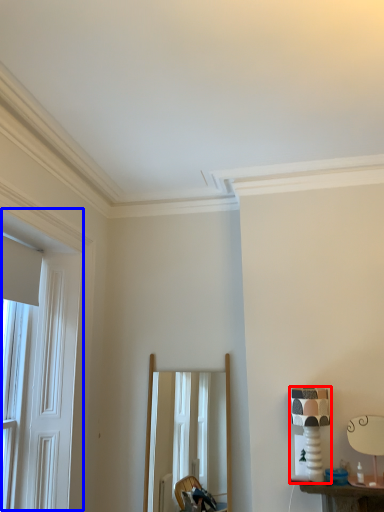
Question: Which object is closer to the camera taking this photo, table lamp (highlighted by a red box) or window (highlighted by a blue box)?

Choices:
 (A) table lamp
 (B) window

Answer: (B)